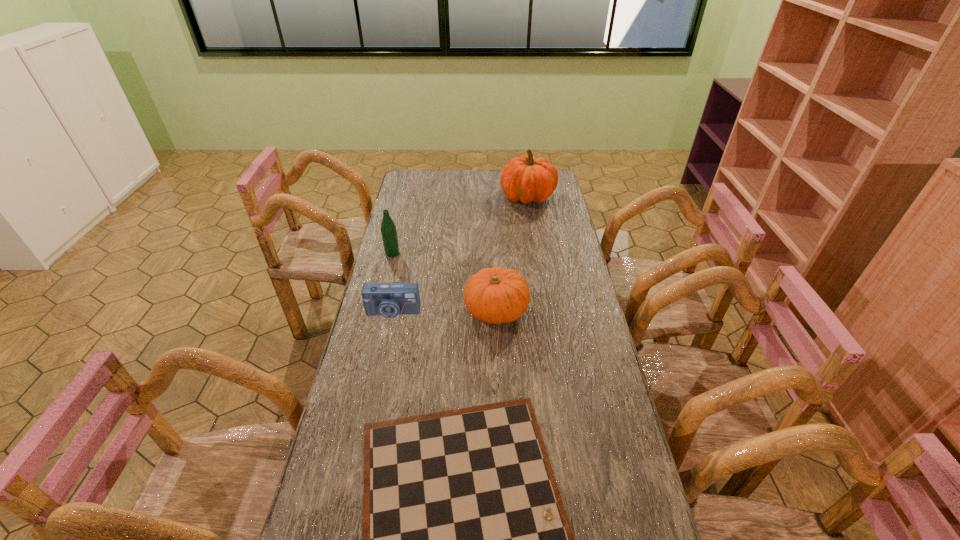
This screenshot has width=960, height=540. What are the coordinates of `the taller pumpkin` in the screenshot? It's located at (525, 178).

This screenshot has width=960, height=540. Find the location of `the tallest object`. the tallest object is located at coordinates (525, 178).

You are a GUI agent. You are given a task and a screenshot of the screen. Output one action in this format:
    pyautogui.click(x=<x>, y=<y>)
    Task: Click on the fourth nearest object
    
    Given the screenshot: What is the action you would take?
    pyautogui.click(x=388, y=228)

Locate an element on the screen. The width and height of the screenshot is (960, 540). bottle is located at coordinates point(388,228).

This screenshot has width=960, height=540. I want to click on the third tallest object, so click(496, 295).

Find the location of a particular element. The width and height of the screenshot is (960, 540). the nearer pumpkin is located at coordinates (496, 295).

The image size is (960, 540). In order to click on camera in this screenshot , I will do `click(389, 300)`.

You are a GUI agent. You are given a task and a screenshot of the screen. Output one action in this format:
    pyautogui.click(x=<x>, y=<y>)
    Task: Click on the free space located 0.070m on the front of the farthest object
    
    Given the screenshot: What is the action you would take?
    pyautogui.click(x=532, y=221)

Find the location of a particular element. free space located on the front of the bottle is located at coordinates (378, 313).

This screenshot has width=960, height=540. I want to click on free spot located on the front of the shorter pumpkin, so click(499, 380).